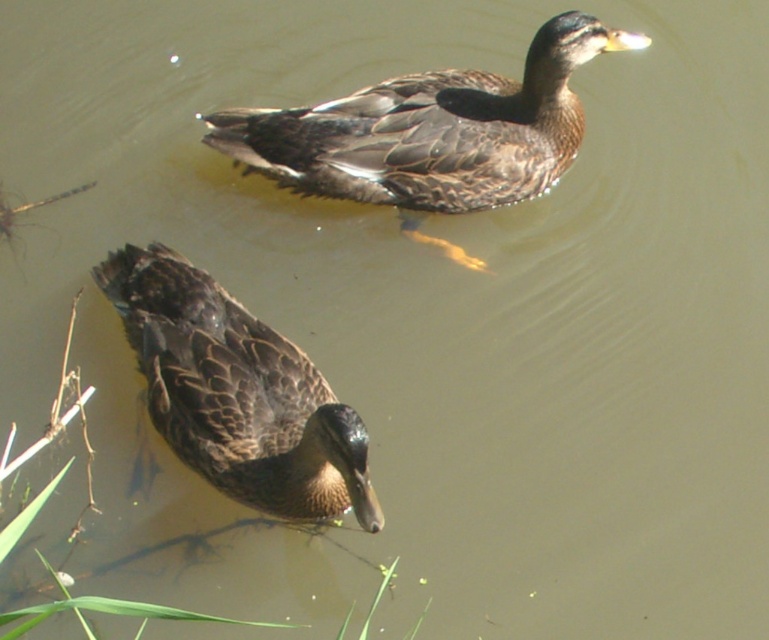
Question: Is brown feathered duck at upper center thinner than dark brown feathers at lower left?

Choices:
 (A) no
 (B) yes

Answer: (A)

Question: Which object is closer to the camera taking this photo?

Choices:
 (A) brown feathered duck at upper center
 (B) dark brown feathers at lower left

Answer: (B)

Question: From the image, what is the correct spatial relationship of brown feathered duck at upper center in relation to dark brown feathers at lower left?

Choices:
 (A) left
 (B) right

Answer: (B)

Question: Which point is farther from the camera taking this photo?

Choices:
 (A) (298, 504)
 (B) (531, 45)

Answer: (B)

Question: Which of the following is the farthest from the observer?

Choices:
 (A) (318, 104)
 (B) (278, 484)

Answer: (A)

Question: Does brown feathered duck at upper center have a greater width compared to dark brown feathers at lower left?

Choices:
 (A) yes
 (B) no

Answer: (A)